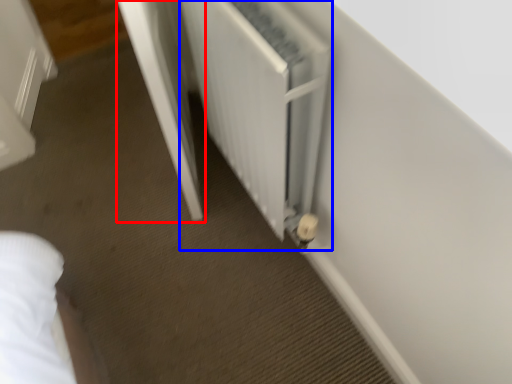
Question: Which object appears farthest to the camera in this image, screen door (highlighted by a red box) or radiator (highlighted by a blue box)?

Choices:
 (A) screen door
 (B) radiator

Answer: (A)